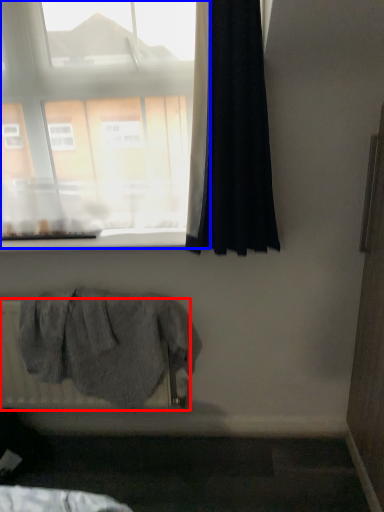
Question: Which object appears closest to the camera in this image, radiator (highlighted by a red box) or window (highlighted by a blue box)?

Choices:
 (A) radiator
 (B) window

Answer: (B)